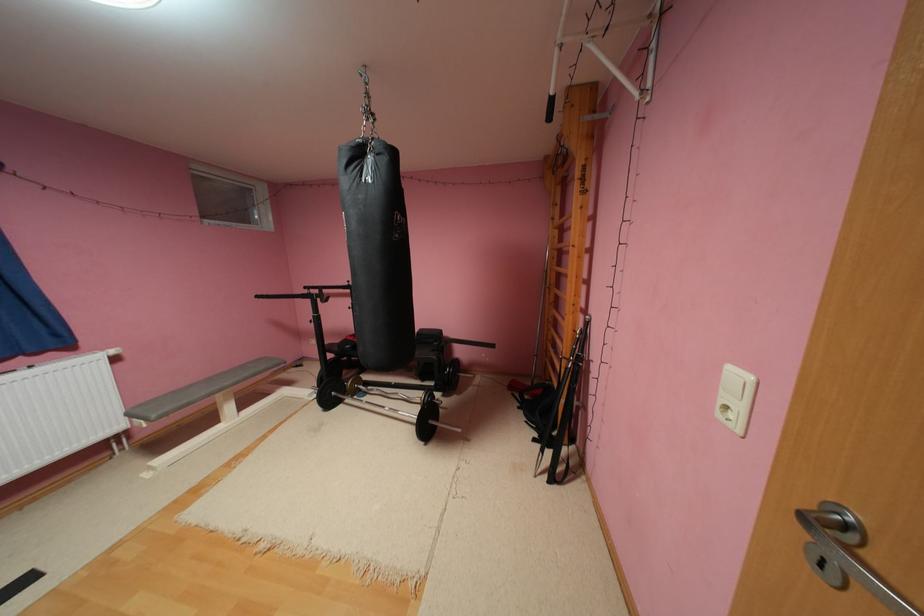
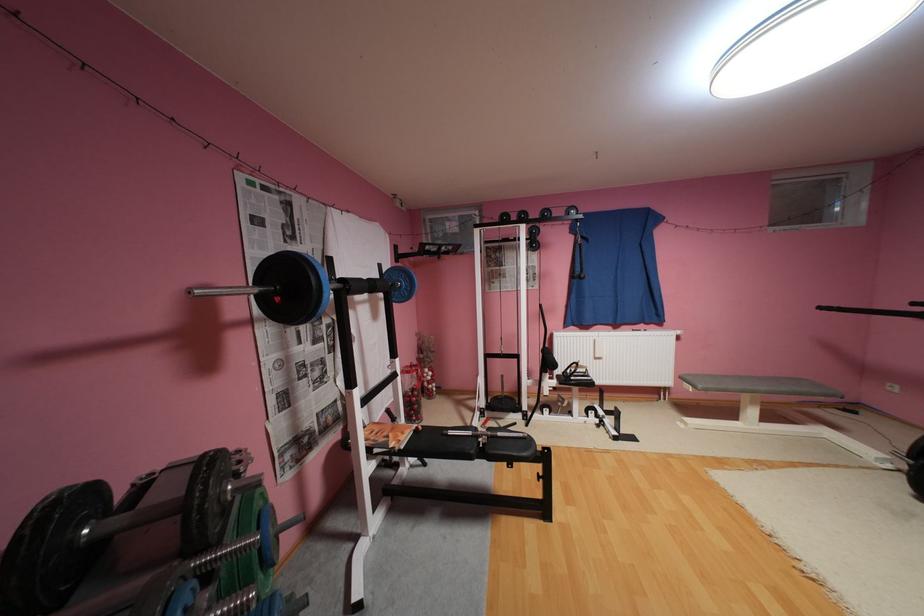
Where in the second image is the point corresponding to (x=236, y=383) from the first image?

(771, 387)